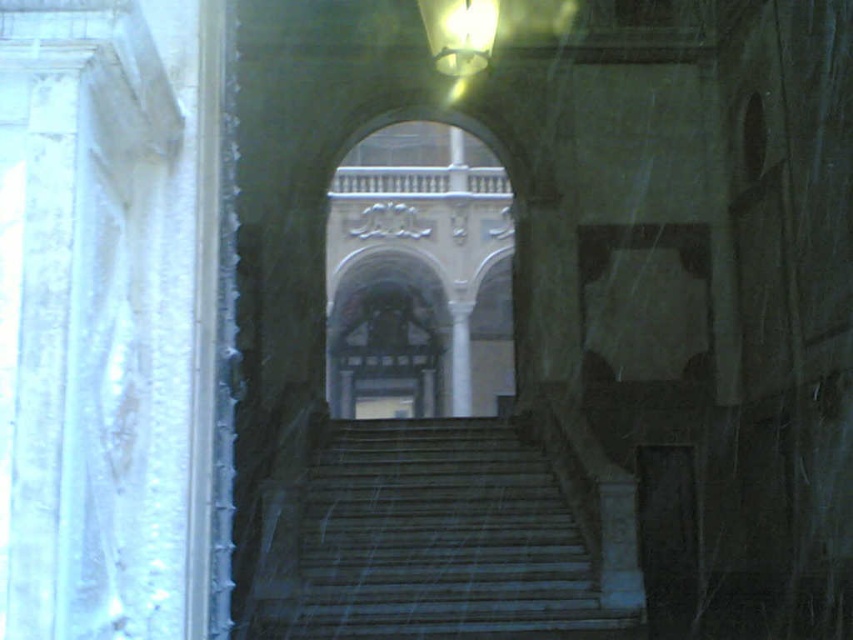
You are an architect analyzing the structure of the building. You need to determine if the dark gray stone stairs at center can support the weight of the white marble archway at center based on their dimensions. Can they?

The dark gray stone stairs at center is thinner than the white marble archway at center, so it may not be able to support the weight of the archway due to its narrower structure.

You are standing at the bottom of the grand staircase and want to reach the building at the top. If you walk straight towards the building, how far will you have to walk to reach the point at coordinates point (372, 300)?

You will have to walk 218.95 feet to reach the point at coordinates point (372, 300) because the distance between the viewer and that point is 218.95 feet.